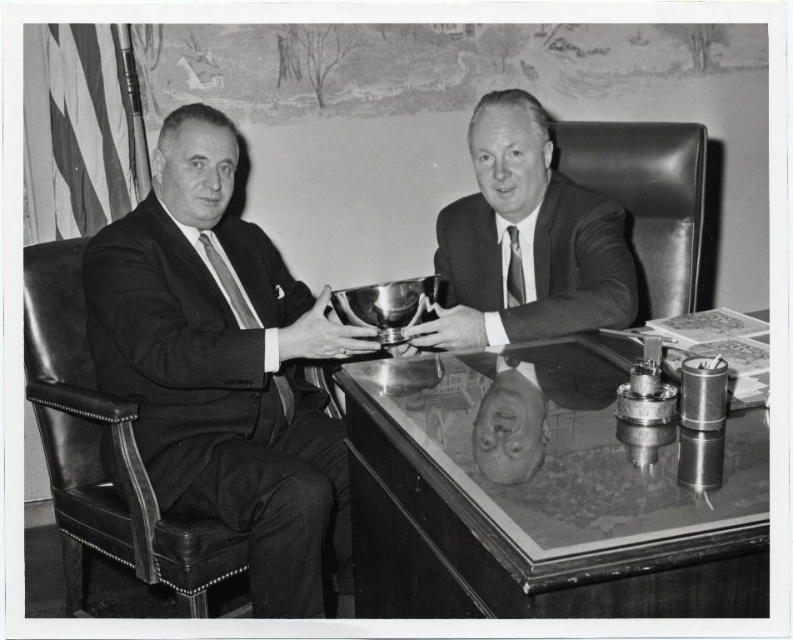
You are a guest at a formal event and need to place your coat on the shiny glass table at center. However, there is a matte black suit at left nearby. Which object should you avoid placing your coat on to respect the existing arrangement?

You should avoid placing your coat on the shiny glass table at center because it is already occupied by the matte black suit at left, which is positioned to the right of it.